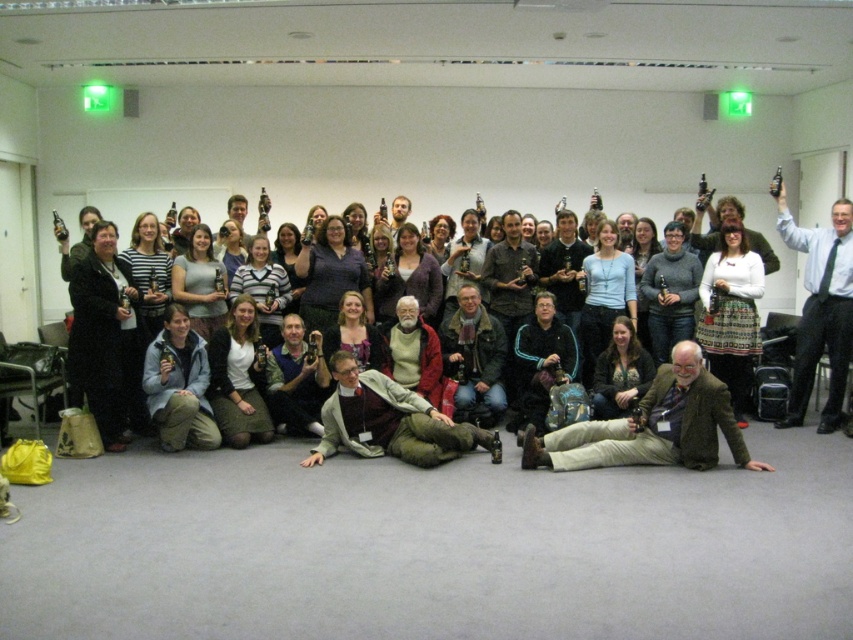
Question: Which point is closer to the camera?

Choices:
 (A) white shirt at upper right
 (B) light gray sweater at center

Answer: (B)

Question: Is light gray sweater at center to the right of white shirt at upper right from the viewer's perspective?

Choices:
 (A) yes
 (B) no

Answer: (B)

Question: Is light gray sweater at center behind white shirt at upper right?

Choices:
 (A) yes
 (B) no

Answer: (B)

Question: Which point is farther to the camera?

Choices:
 (A) white shirt at upper right
 (B) light gray sweater at center

Answer: (A)

Question: Does light gray sweater at center have a greater width compared to white shirt at upper right?

Choices:
 (A) yes
 (B) no

Answer: (A)